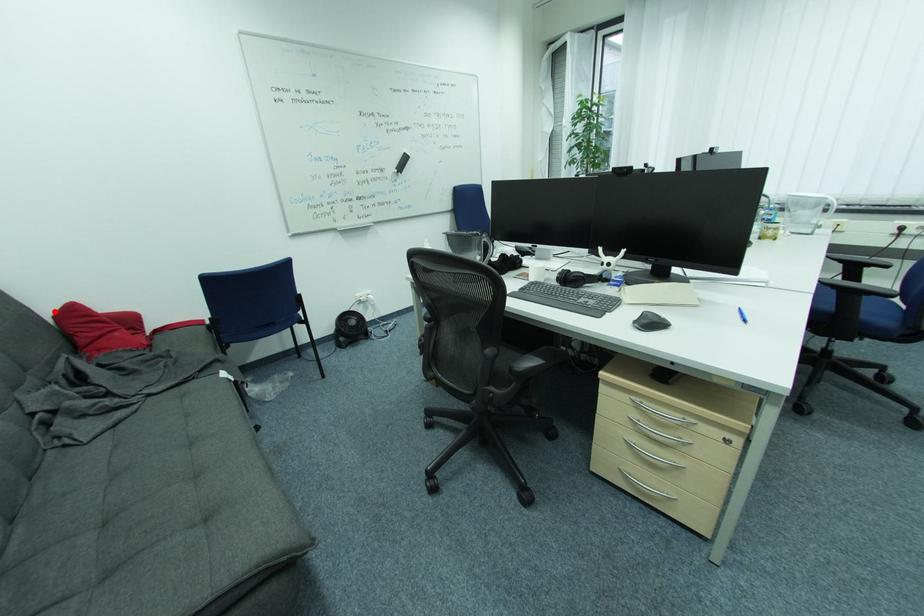
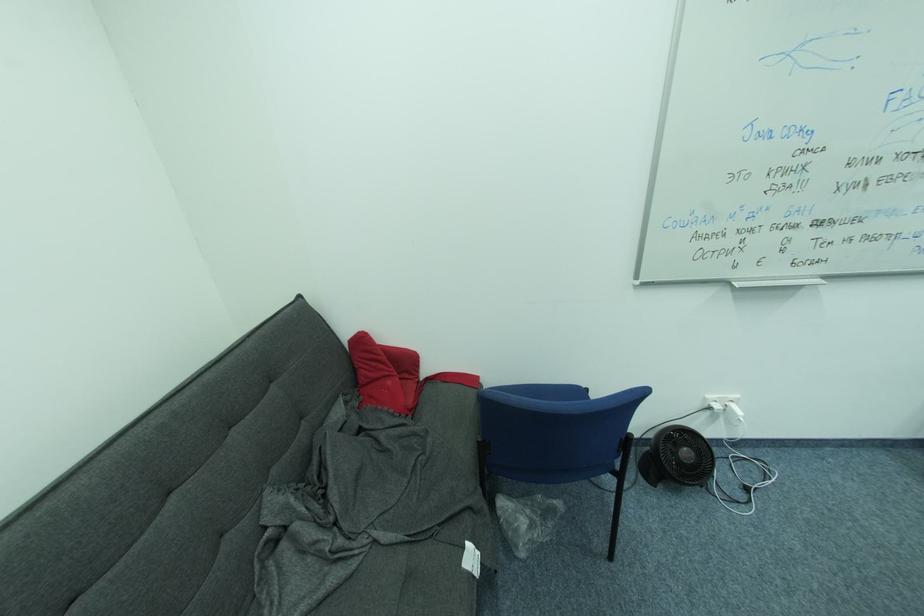
Where in the second image is the point corresponding to the highlighted location from the first image?

(353, 336)